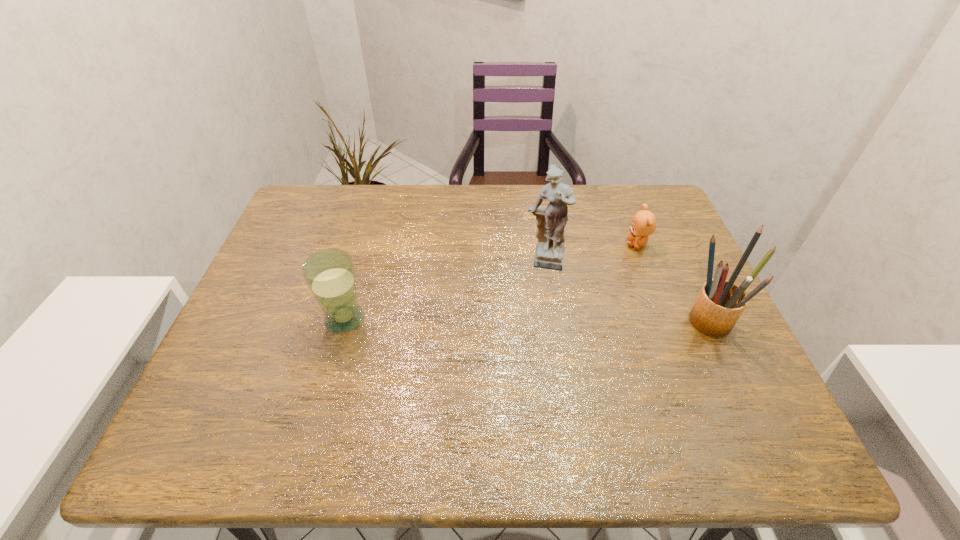
This screenshot has width=960, height=540. I want to click on the second shortest object, so click(330, 275).

This screenshot has width=960, height=540. In order to click on the leftmost object in this screenshot , I will do `click(330, 275)`.

In order to click on pencil box in this screenshot , I will do `click(720, 303)`.

This screenshot has width=960, height=540. In order to click on teddy bear in this screenshot , I will do `click(643, 224)`.

Find the location of a particular element. The height and width of the screenshot is (540, 960). figurine is located at coordinates (551, 221).

You are a GUI agent. You are given a task and a screenshot of the screen. Output one action in this format:
    pyautogui.click(x=<x>, y=<y>)
    Task: Click on the tallest object
    This screenshot has height=540, width=960.
    Given the screenshot: What is the action you would take?
    pyautogui.click(x=551, y=221)

At what (x,y) coordinates should I click in order to perform the action: click on free space located on the back of the glass. Please return your answer as a coordinate pair (x, y). The width and height of the screenshot is (960, 540). Looking at the image, I should click on (356, 277).

Where is `free region located on the front of the pencil box`? The image size is (960, 540). free region located on the front of the pencil box is located at coordinates (748, 409).

Find the location of a particular element. This screenshot has height=540, width=960. vacant space located 0.400m on the face of the teddy bear is located at coordinates (544, 335).

This screenshot has width=960, height=540. What are the coordinates of `vacant space positioned on the face of the teddy bear` in the screenshot? It's located at (596, 285).